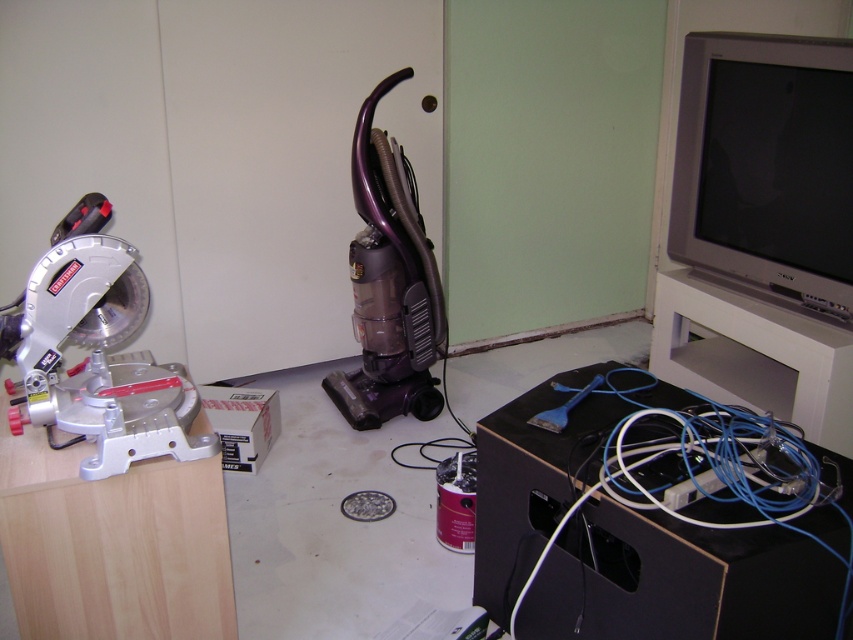
The width and height of the screenshot is (853, 640). What do you see at coordinates (97, 352) in the screenshot? I see `silver metallic miter saw at left` at bounding box center [97, 352].

Does silver metallic miter saw at left lie behind blue rubber spatula at center?

No, silver metallic miter saw at left is closer to the viewer.

The width and height of the screenshot is (853, 640). Describe the element at coordinates (97, 352) in the screenshot. I see `silver metallic miter saw at left` at that location.

Where is `silver metallic miter saw at left`? silver metallic miter saw at left is located at coordinates (97, 352).

Who is shorter, blue cable at lower right or silver metallic miter saw at left?

Standing shorter between the two is silver metallic miter saw at left.

Can you confirm if blue cable at lower right is positioned to the left of silver metallic miter saw at left?

Incorrect, blue cable at lower right is not on the left side of silver metallic miter saw at left.

Is point (570, 449) closer to camera compared to point (100, 390)?

That is False.

Locate an element on the screen. blue cable at lower right is located at coordinates (714, 509).

From the picture: Can you confirm if blue cable at lower right is positioned to the right of purple plastic vacuum cleaner at center?

Indeed, blue cable at lower right is positioned on the right side of purple plastic vacuum cleaner at center.

Can you confirm if blue cable at lower right is positioned below purple plastic vacuum cleaner at center?

Correct, blue cable at lower right is located below purple plastic vacuum cleaner at center.

The image size is (853, 640). In order to click on blue cable at lower right in this screenshot , I will do `click(714, 509)`.